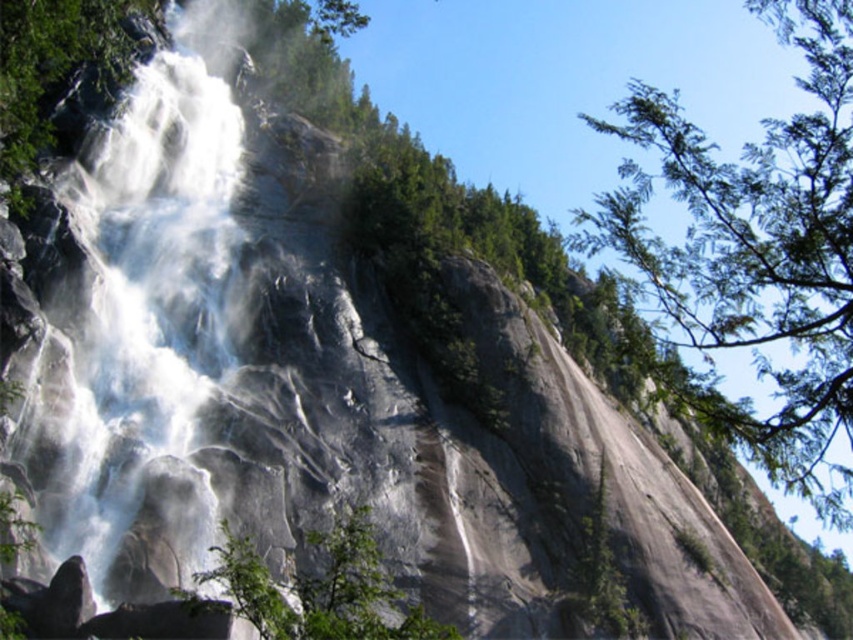
Which is more to the left, white mist at center or green leafy tree at center?

white mist at center is more to the left.

Can you confirm if white mist at center is positioned below green leafy tree at center?

Actually, white mist at center is above green leafy tree at center.

Between point (90, 372) and point (408, 625), which one is positioned behind?

The point (90, 372) is behind.

Where is `white mist at center`? Image resolution: width=853 pixels, height=640 pixels. white mist at center is located at coordinates (143, 324).

Does green leafy tree at upper right have a greater width compared to green leafy tree at center?

Indeed, green leafy tree at upper right has a greater width compared to green leafy tree at center.

Based on the photo, can you confirm if green leafy tree at upper right is thinner than green leafy tree at center?

Incorrect, green leafy tree at upper right's width is not less than green leafy tree at center's.

The width and height of the screenshot is (853, 640). What are the coordinates of `green leafy tree at upper right` in the screenshot? It's located at (758, 248).

Can you confirm if white mist at center is taller than green leafy tree at upper right?

No.

Does white mist at center appear over green leafy tree at upper right?

Yes.

Find the location of `white mist at center`. white mist at center is located at coordinates (143, 324).